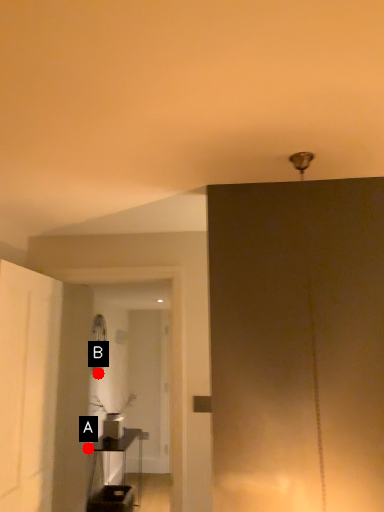
Question: Two points are circled on the image, labeled by A and B beside each circle. Which point is farther to the camera?

Choices:
 (A) A is further
 (B) B is further

Answer: (B)